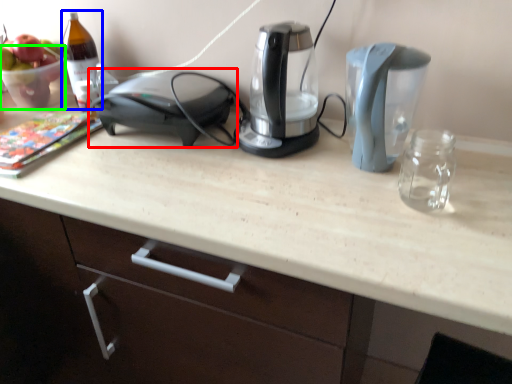
Question: Which object is positioned closest to home appliance (highlighted by a red box)? Select from wine bottle (highlighted by a blue box) and glass bowl (highlighted by a green box).

Choices:
 (A) wine bottle
 (B) glass bowl

Answer: (A)